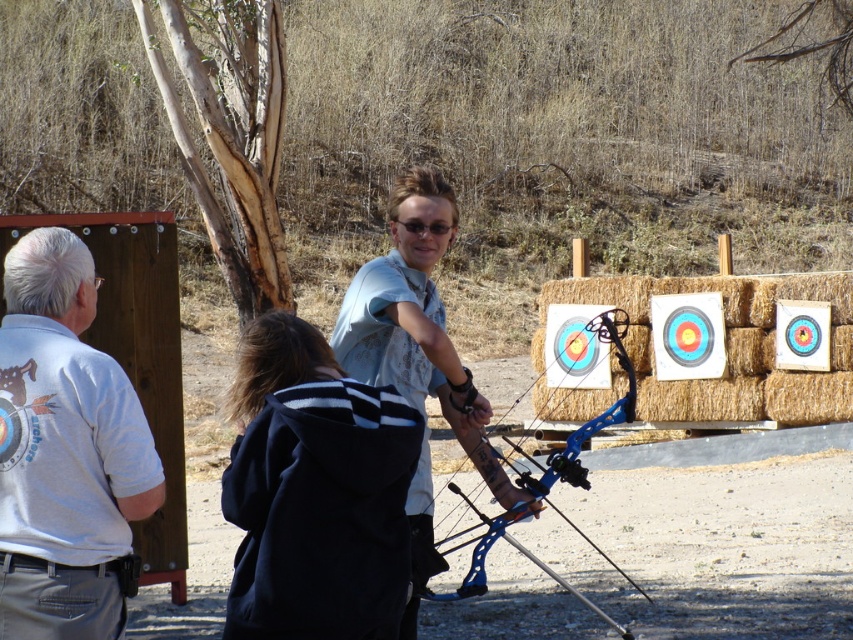
You are an archer standing at the center of the scene. You need to check if your black fleece jacket at center is within the safe distance from the archery targets to avoid any stray arrows. According to the coordinates provided, is the jacket positioned safely?

The black fleece jacket at center is located at point (315, 492). Based on standard archery range safety protocols, if this coordinate places the jacket outside the designated shooting line or behind the targets, it would be considered safe. However, without specific range layout details, it is recommended to move the jacket to a clearly marked safe zone to ensure safety.

You are standing in the archery range and see the point at coordinates (260, 433). If you want to place a new target 10 feet away from you, where should you place it relative to the point?

The point at coordinates (260, 433) is 13.84 feet away from you. To place a new target 10 feet away, you should move it closer to you by approximately 3.84 feet from the point.